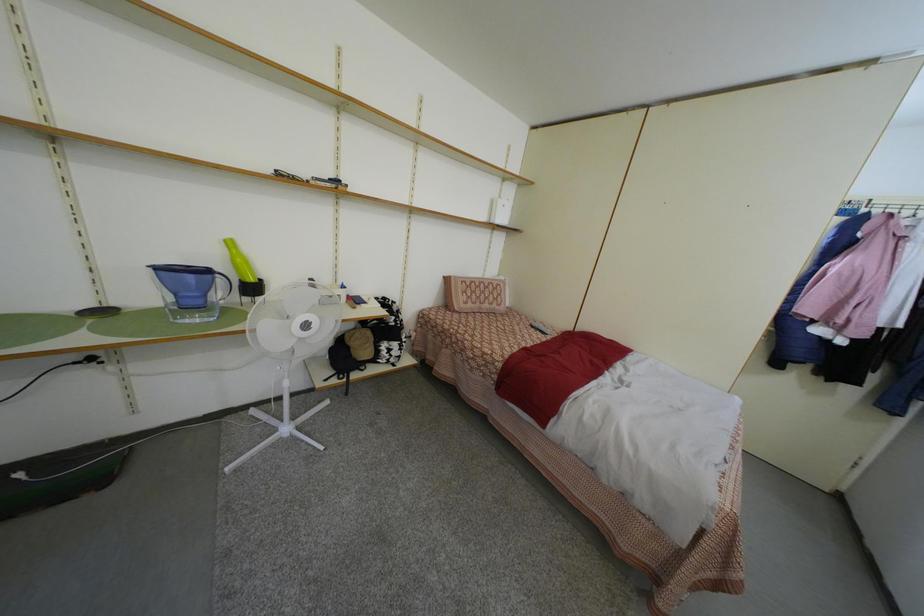
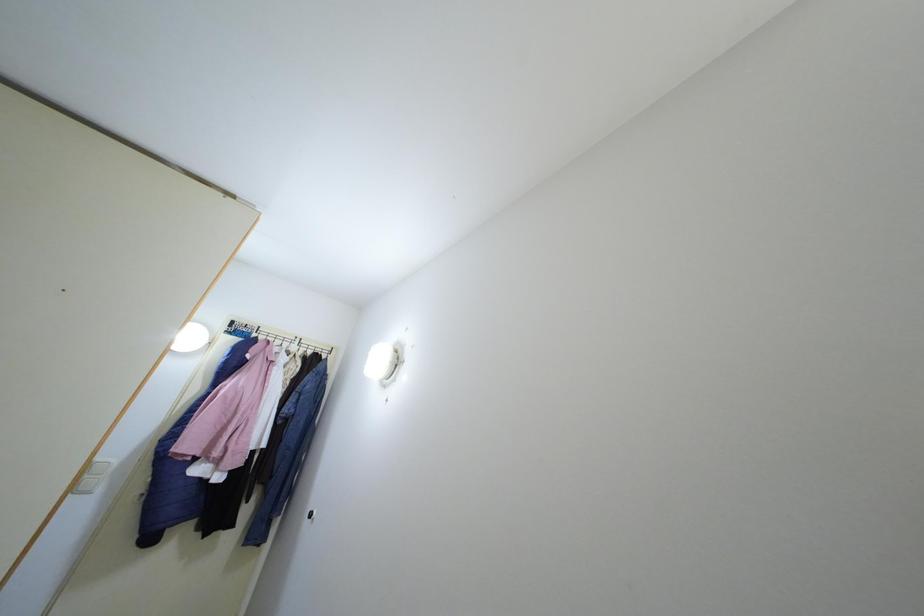
The images are taken continuously from a first-person perspective. In which direction is your viewpoint rotating?

The rotation direction of the camera is right-up.